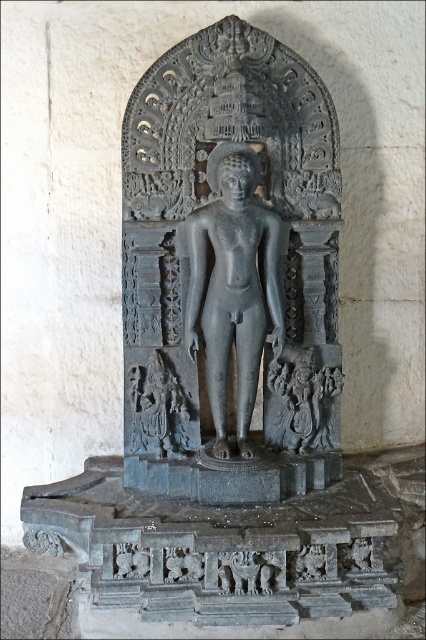
Question: Which point is farther to the camera?

Choices:
 (A) dark gray stone carving at lower left
 (B) gray stone statue at center
 (C) black stone statue at center

Answer: (A)

Question: Is black stone statue at center smaller than dark gray stone carving at lower left?

Choices:
 (A) yes
 (B) no

Answer: (B)

Question: Is the position of gray stone statue at center more distant than that of dark gray stone carving at lower left?

Choices:
 (A) no
 (B) yes

Answer: (A)

Question: Which point is closer to the camera?

Choices:
 (A) (213, 241)
 (B) (132, 369)
 (C) (238, 163)

Answer: (C)

Question: Considering the real-world distances, which object is closest to the dark gray stone carving at lower left?

Choices:
 (A) black stone statue at center
 (B) gray stone statue at center

Answer: (B)

Question: Does gray stone statue at center appear over dark gray stone carving at lower left?

Choices:
 (A) no
 (B) yes

Answer: (B)